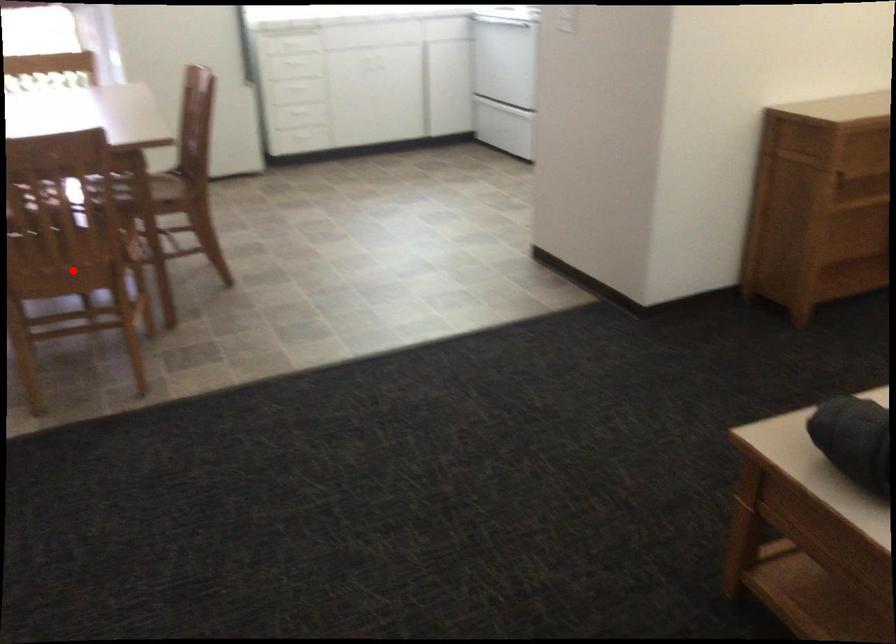
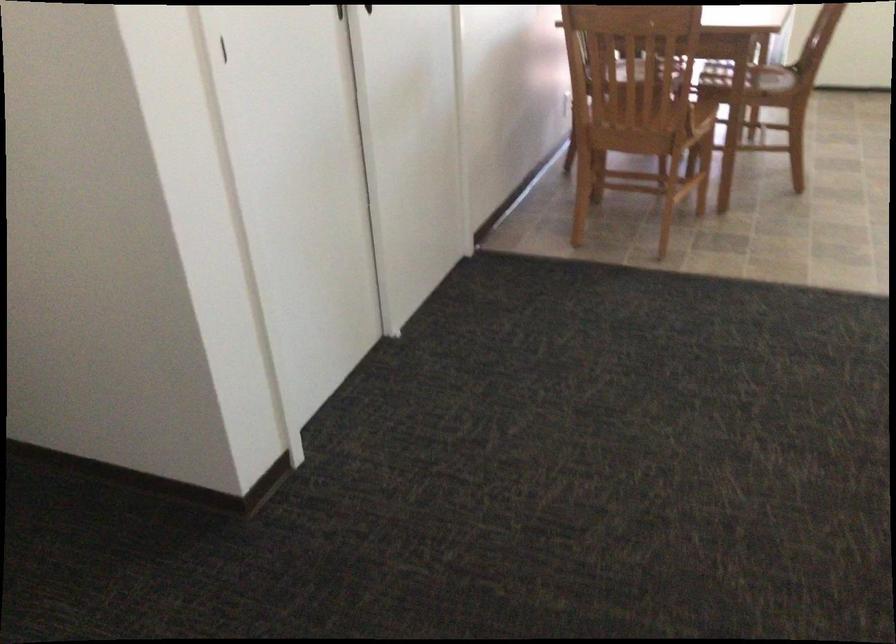
Where in the second image is the point corresponding to the highlighted location from the first image?

(645, 127)